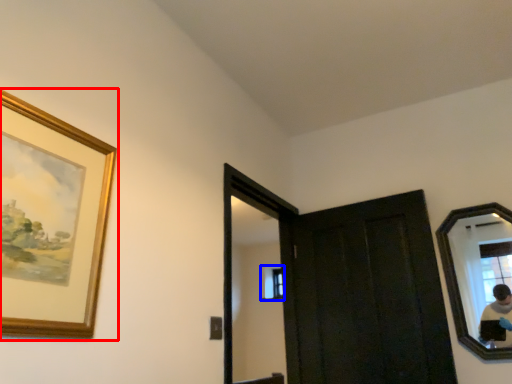
Question: Among these objects, which one is nearest to the camera, picture frame (highlighted by a red box) or window (highlighted by a blue box)?

Choices:
 (A) picture frame
 (B) window

Answer: (A)